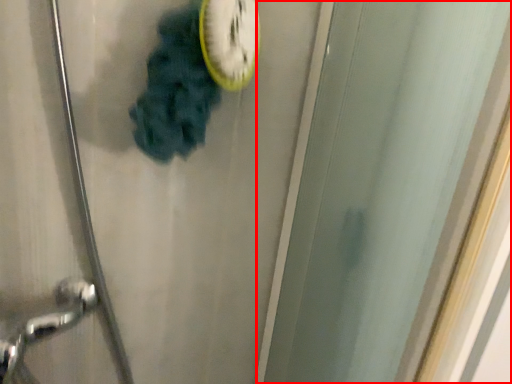
Question: Observing the image, what is the correct spatial positioning of screen door (annotated by the red box) in reference to clock?

Choices:
 (A) right
 (B) left

Answer: (A)